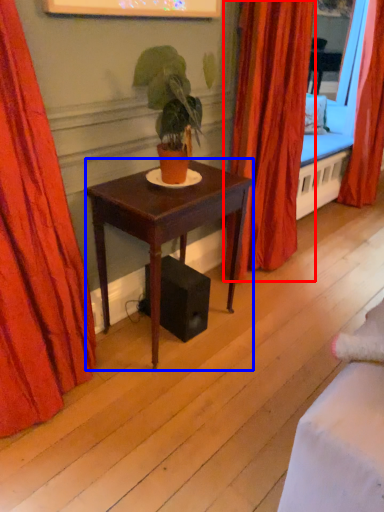
Question: Among these objects, which one is farthest to the camera, curtain (highlighted by a red box) or desk (highlighted by a blue box)?

Choices:
 (A) curtain
 (B) desk

Answer: (A)